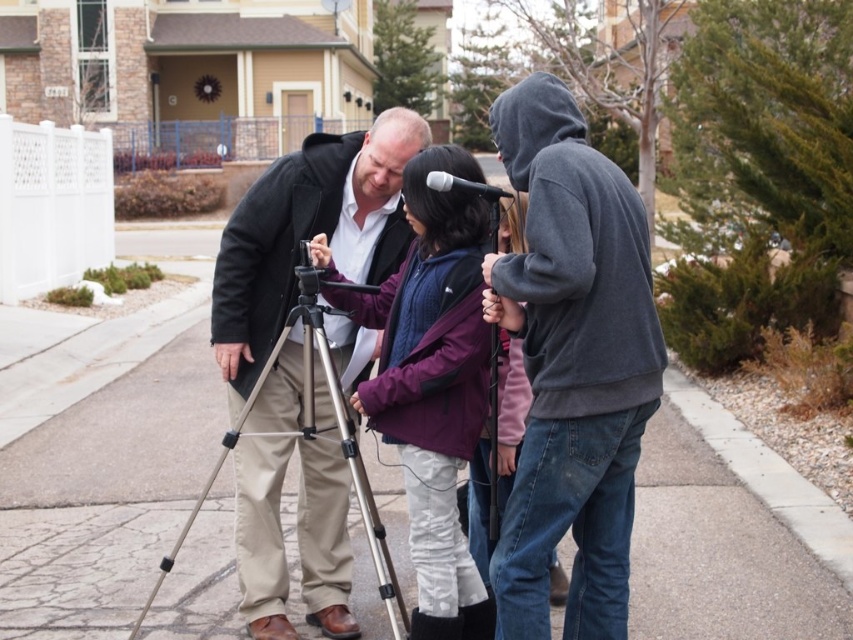
Does silver metallic tripod at center have a greater width compared to matte gray hoodie at center?

No.

Which is below, silver metallic tripod at center or matte gray hoodie at center?

silver metallic tripod at center is below.

Locate an element on the screen. This screenshot has height=640, width=853. silver metallic tripod at center is located at coordinates (310, 432).

Who is more distant from viewer, (169,593) or (730,419)?

The point (730,419) is behind.

Is point (674, 632) farther from viewer compared to point (751, 472)?

No, it is not.

Image resolution: width=853 pixels, height=640 pixels. I want to click on metallic tripod at center, so click(x=107, y=492).

Between purple fleece jacket at center and gray concrete curb at lower right, which one appears on the right side from the viewer's perspective?

Positioned to the right is gray concrete curb at lower right.

Identify the location of purple fleece jacket at center. (433, 384).